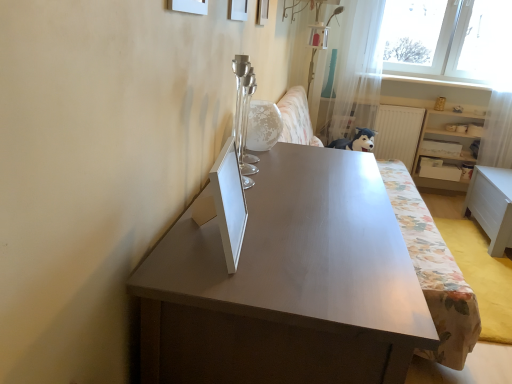
The height and width of the screenshot is (384, 512). Find the location of `vacant area that is in front of white glossy globe at center`. vacant area that is in front of white glossy globe at center is located at coordinates (279, 160).